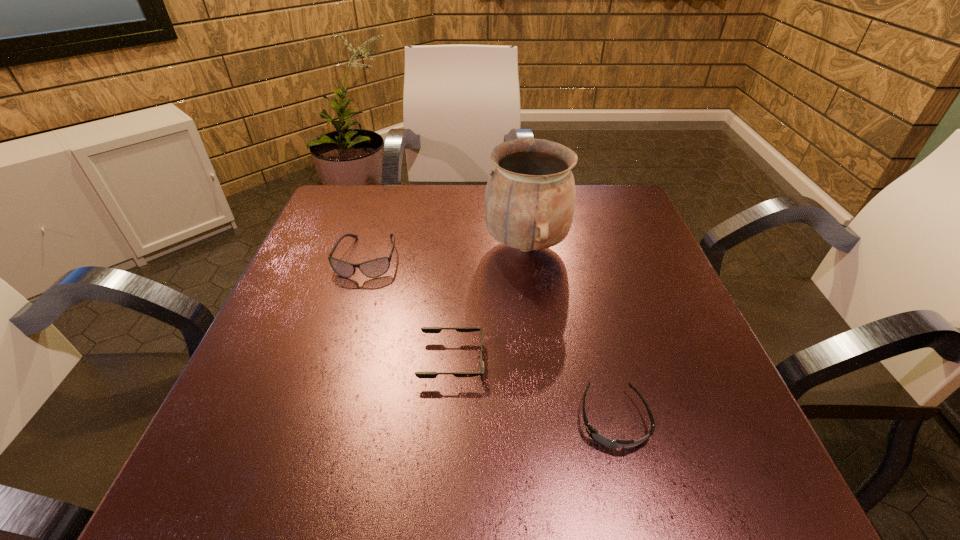
This screenshot has width=960, height=540. I want to click on the tallest object, so point(529,203).

The height and width of the screenshot is (540, 960). What are the coordinates of `the farthest sunglasses` in the screenshot? It's located at (375, 268).

You are a GUI agent. You are given a task and a screenshot of the screen. Output one action in this format:
    pyautogui.click(x=<x>, y=<y>)
    Task: Click on the leftmost sunglasses
    The height and width of the screenshot is (540, 960).
    Given the screenshot: What is the action you would take?
    pyautogui.click(x=375, y=268)

Find the location of a particular element. the second object from left to right is located at coordinates (424, 329).

You are a GUI agent. You are given a task and a screenshot of the screen. Output one action in this format:
    pyautogui.click(x=<x>, y=<y>)
    Task: Click on the third farthest object
    
    Given the screenshot: What is the action you would take?
    pos(424,329)

Where is `the rightmost sunglasses`? the rightmost sunglasses is located at coordinates (593, 433).

The image size is (960, 540). I want to click on the nearest object, so click(593, 433).

Where is `free space located 0.270m on the left of the tallest object`? This screenshot has width=960, height=540. free space located 0.270m on the left of the tallest object is located at coordinates (369, 247).

Identify the location of blank space located on the lenses of the second tallest object. (307, 448).

Where is `free location located on the temples of the second sunglasses from left to right`? This screenshot has height=540, width=960. free location located on the temples of the second sunglasses from left to right is located at coordinates (698, 361).